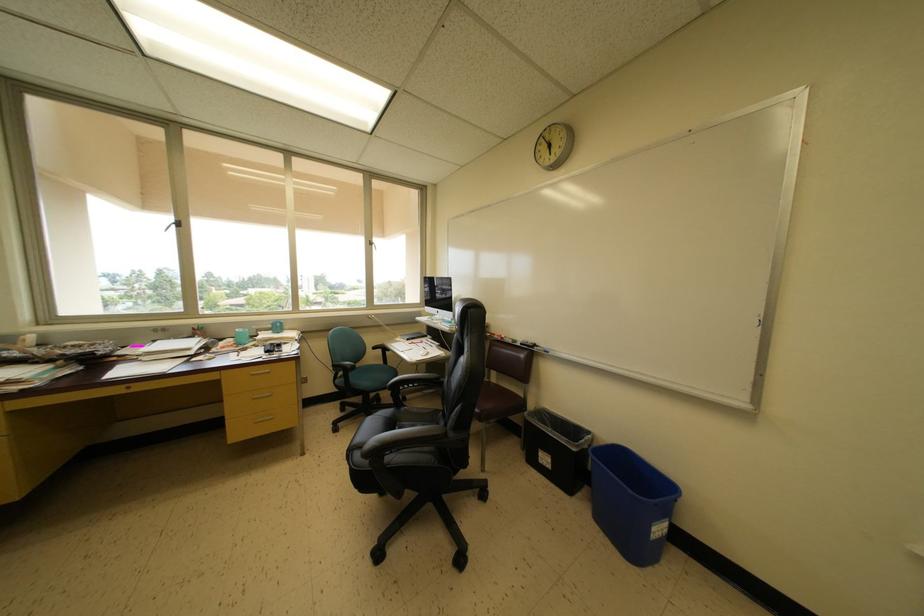
Find where to sit the brown chair sitting surface. Please return your answer as a coordinate pair (x, y).

(496, 403)